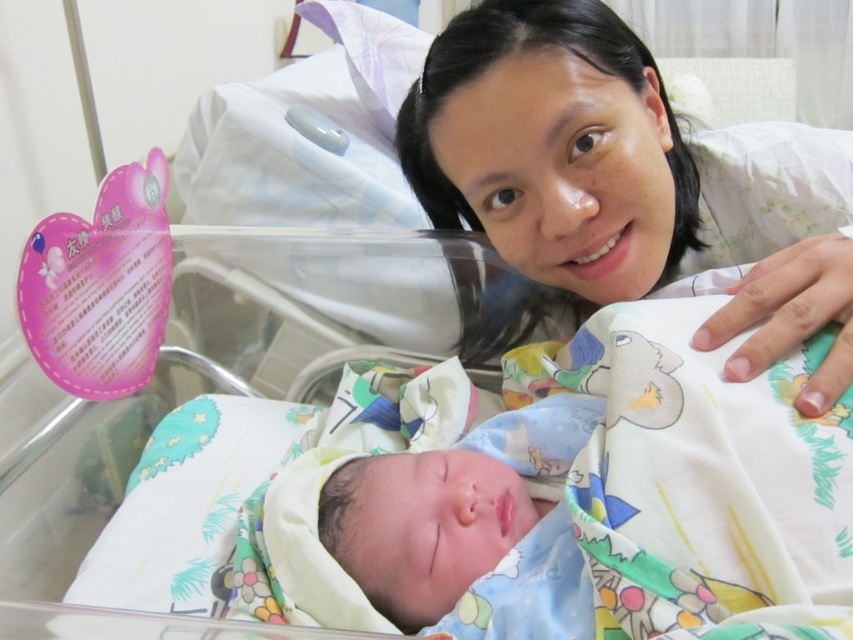
Question: Does white fabric at upper center have a greater width compared to soft blue fabric at center?

Choices:
 (A) yes
 (B) no

Answer: (A)

Question: From the image, what is the correct spatial relationship of white fabric at upper center in relation to soft blue fabric at center?

Choices:
 (A) below
 (B) above

Answer: (B)

Question: Where is white fabric at upper center located in relation to soft blue fabric at center in the image?

Choices:
 (A) above
 (B) below

Answer: (A)

Question: Among these points, which one is nearest to the camera?

Choices:
 (A) (548, 577)
 (B) (834, 396)

Answer: (B)

Question: Which of the following is the farthest from the observer?

Choices:
 (A) (430, 56)
 (B) (488, 536)

Answer: (A)